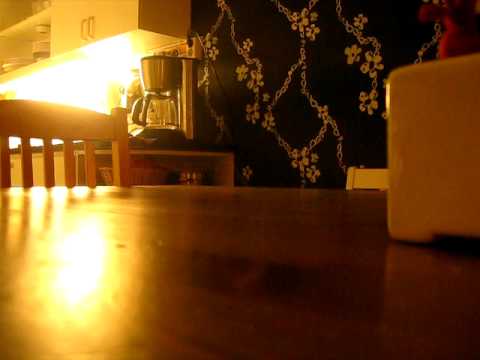
Locate an element on the screen. The height and width of the screenshot is (360, 480). cup is located at coordinates (406, 212).